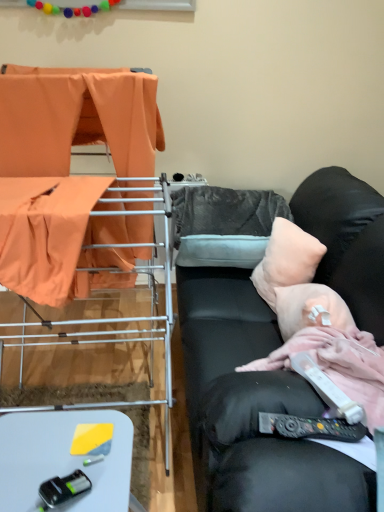
What are the coordinates of `blank space to the left of black plastic toy car at lower left, the 1th equipment ordered from the bottom` in the screenshot? It's located at (23, 476).